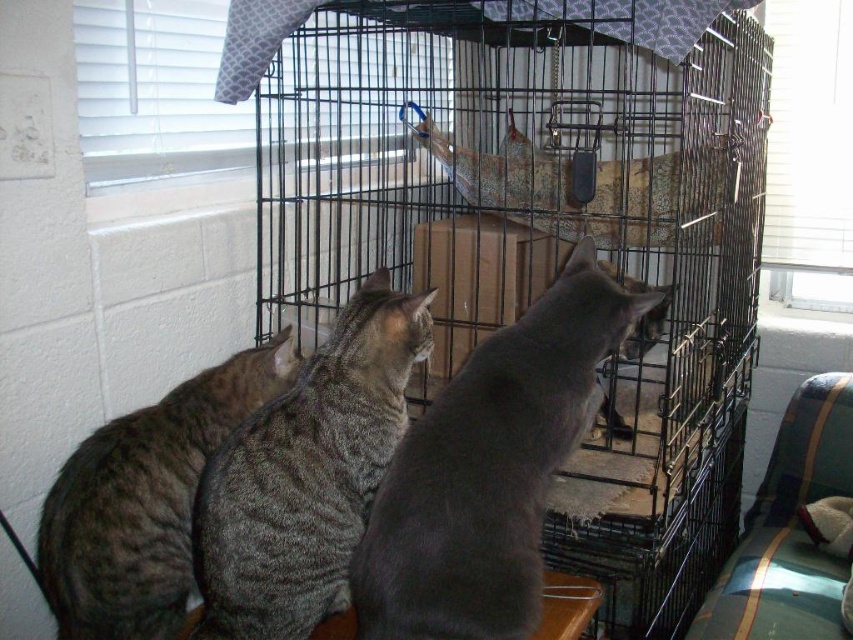
Is black wire cage at center taller than gray striped cat at left?

Yes, black wire cage at center is taller than gray striped cat at left.

Does black wire cage at center lie in front of gray striped cat at left?

No, it is not.

Identify the location of black wire cage at center. (540, 232).

Locate an element on the screen. Image resolution: width=853 pixels, height=640 pixels. black wire cage at center is located at coordinates (540, 232).

Between point (663, 60) and point (471, 365), which one is positioned behind?

Positioned behind is point (663, 60).

Can you confirm if black wire cage at center is positioned to the right of gray matte fur cat at center?

Indeed, black wire cage at center is positioned on the right side of gray matte fur cat at center.

At what (x,y) coordinates should I click in order to perform the action: click on black wire cage at center. Please return your answer as a coordinate pair (x, y). The height and width of the screenshot is (640, 853). Looking at the image, I should click on (540, 232).

Who is lower down, gray striped cat at center or gray striped cat at left?

gray striped cat at left

Between gray striped cat at center and gray striped cat at left, which one has more height?

Standing taller between the two is gray striped cat at center.

Who is more distant from viewer, (x=317, y=493) or (x=167, y=516)?

The point (x=167, y=516) is behind.

At what (x,y) coordinates should I click in order to perform the action: click on gray striped cat at center. Please return your answer as a coordinate pair (x, y). This screenshot has width=853, height=640. Looking at the image, I should click on (306, 474).